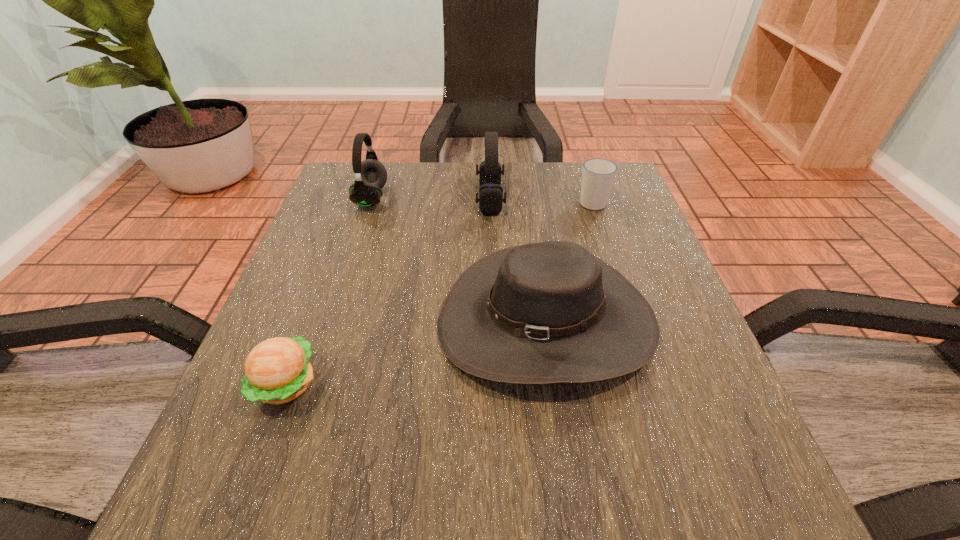
Where is `the right headset`? This screenshot has width=960, height=540. the right headset is located at coordinates (490, 199).

This screenshot has width=960, height=540. I want to click on the left headset, so click(371, 175).

Find the location of a particular element. cowboy hat is located at coordinates (551, 312).

Identify the location of cup. (598, 175).

The height and width of the screenshot is (540, 960). I want to click on the shortest object, so click(277, 370).

Identify the location of free location located on the headband of the right headset. This screenshot has width=960, height=540. (364, 199).

Locate an element on the screen. The height and width of the screenshot is (540, 960). free region located on the headband of the right headset is located at coordinates (389, 199).

Find the location of `vacant space located on the headband of the right headset`. vacant space located on the headband of the right headset is located at coordinates (348, 199).

Locate an element on the screen. vacant area located 0.270m on the ear cups of the left headset is located at coordinates (499, 198).

Find the location of `vacant space positioned 0.090m on the front-facing side of the cowboy hat`. vacant space positioned 0.090m on the front-facing side of the cowboy hat is located at coordinates (566, 462).